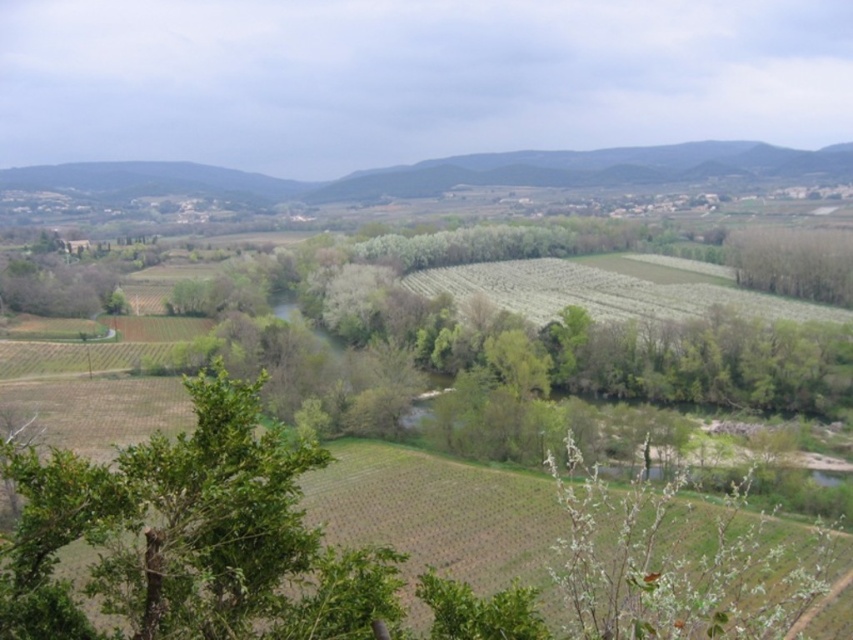
You are standing at the highest point of the hill and want to walk towards the point labeled as point (x=132, y=582). While walking, you notice another point labeled point (x=732, y=248). Which point will you encounter first on your path?

You will encounter point (x=132, y=582) first because it is in front of point (x=732, y=248) along your path.

You are a landscape architect designing a new park and want to incorporate the green leafy tree at lower left and the green leafy trees at right. Which of these trees would you choose if you need a wider tree for a shaded area?

The green leafy trees at right are wider than the green leafy tree at lower left, so you should choose the green leafy trees at right for a wider shaded area.

You are standing at point (x=189, y=536) in the rural landscape. What do you see immediately around you?

You see a green leafy tree at lower left immediately around you.